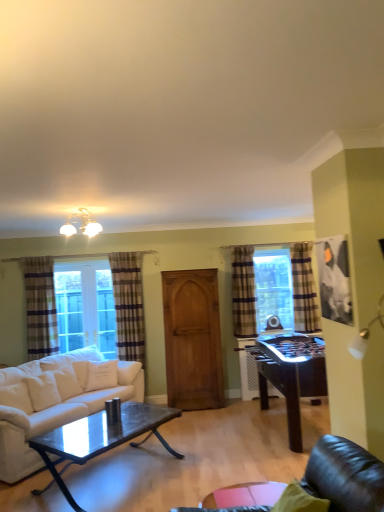
Question: Is plaid fabric curtain at left, the 4th curtain from the right, not close to matte white chandelier at upper center?

Choices:
 (A) yes
 (B) no

Answer: (A)

Question: From the image's perspective, would you say plaid fabric curtain at left, arranged as the 1th curtain when viewed from the left, is shown under matte white chandelier at upper center?

Choices:
 (A) yes
 (B) no

Answer: (A)

Question: Does plaid fabric curtain at left, arranged as the 1th curtain when viewed from the left, have a greater width compared to matte white chandelier at upper center?

Choices:
 (A) no
 (B) yes

Answer: (A)

Question: Does plaid fabric curtain at left, arranged as the 1th curtain when viewed from the left, have a lesser width compared to matte white chandelier at upper center?

Choices:
 (A) yes
 (B) no

Answer: (A)

Question: Can you confirm if plaid fabric curtain at left, the 4th curtain from the right, is bigger than matte white chandelier at upper center?

Choices:
 (A) no
 (B) yes

Answer: (B)

Question: Is matte white chandelier at upper center at the back of plaid fabric curtain at left, the 4th curtain from the right?

Choices:
 (A) no
 (B) yes

Answer: (A)

Question: From the image's perspective, would you say wooden armoire at center is shown under white cotton pillow at lower left, arranged as the 1th pillow when viewed from the back?

Choices:
 (A) no
 (B) yes

Answer: (A)

Question: From a real-world perspective, is wooden armoire at center beneath white cotton pillow at lower left, placed as the first pillow when sorted from right to left?

Choices:
 (A) no
 (B) yes

Answer: (A)

Question: Is white cotton pillow at lower left, the second pillow when ordered from front to back, completely or partially inside wooden armoire at center?

Choices:
 (A) yes
 (B) no

Answer: (B)

Question: Is wooden armoire at center to the right of white cotton pillow at lower left, placed as the first pillow when sorted from right to left, from the viewer's perspective?

Choices:
 (A) no
 (B) yes

Answer: (B)

Question: Would you say wooden armoire at center is outside white cotton pillow at lower left, the second pillow when ordered from front to back?

Choices:
 (A) yes
 (B) no

Answer: (A)

Question: Can you confirm if wooden armoire at center is shorter than white cotton pillow at lower left, arranged as the 1th pillow when viewed from the back?

Choices:
 (A) no
 (B) yes

Answer: (A)

Question: Would you say wooden armoire at center is part of plaid fabric curtain at left, positioned as the second curtain in left-to-right order,'s contents?

Choices:
 (A) yes
 (B) no

Answer: (B)